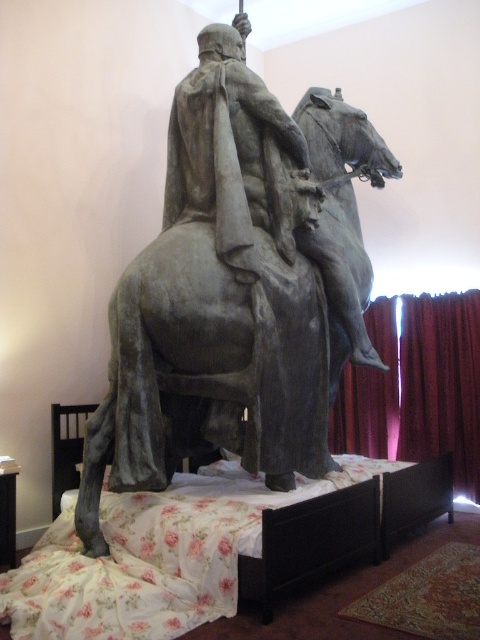
Question: Which of the following is the farthest from the observer?

Choices:
 (A) (225, 346)
 (B) (397, 486)

Answer: (B)

Question: Is gray stone statue at center to the left of floral fabric bed at center from the viewer's perspective?

Choices:
 (A) no
 (B) yes

Answer: (B)

Question: Which object appears closest to the camera in this image?

Choices:
 (A) gray stone statue at center
 (B) floral fabric bed at center

Answer: (B)

Question: Can you confirm if gray stone statue at center is positioned below floral fabric bed at center?

Choices:
 (A) yes
 (B) no

Answer: (B)

Question: Does gray stone statue at center appear on the right side of floral fabric bed at center?

Choices:
 (A) no
 (B) yes

Answer: (A)